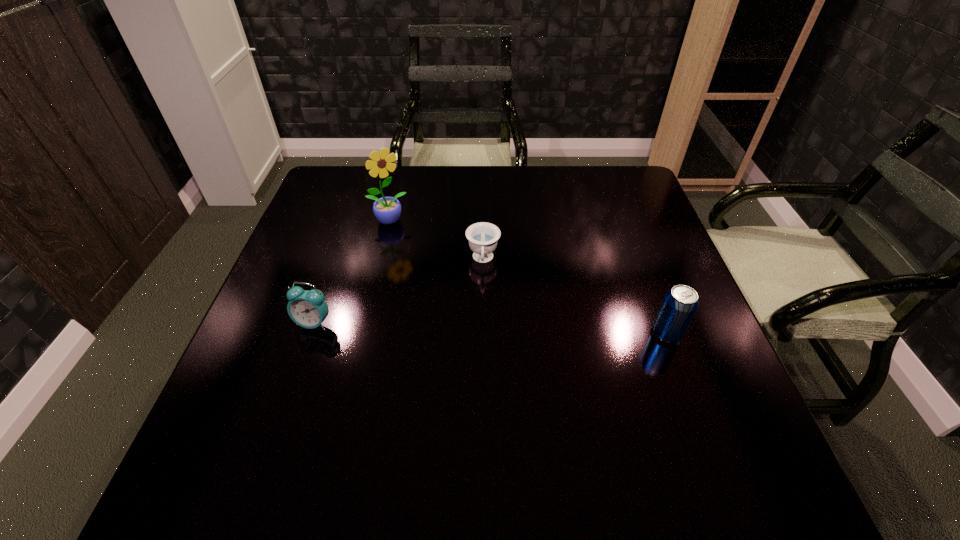
Locate an element on the screen. vacant space located on the side of the second farthest object with the handle is located at coordinates (x=479, y=431).

The image size is (960, 540). Identify the location of free space located on the front-facing side of the sunflower. (443, 293).

Where is `free location located on the front-facing side of the sunflower`? This screenshot has width=960, height=540. free location located on the front-facing side of the sunflower is located at coordinates (435, 283).

Image resolution: width=960 pixels, height=540 pixels. I want to click on free region located 0.230m on the front-facing side of the sunflower, so pos(433,280).

Locate an element on the screen. object positioned at the left edge is located at coordinates (308, 309).

The width and height of the screenshot is (960, 540). Identify the location of object that is at the right edge. (680, 303).

Where is `vacant space at the far edge`? vacant space at the far edge is located at coordinates (523, 184).

This screenshot has height=540, width=960. I want to click on free space at the near edge of the desktop, so click(x=424, y=402).

Identify the location of vacant region at the left edge of the desktop. The height and width of the screenshot is (540, 960). (295, 276).

At what (x,y) coordinates should I click in order to perform the action: click on free space at the right edge of the desktop. Please return your answer as a coordinate pair (x, y). Looking at the image, I should click on (707, 346).